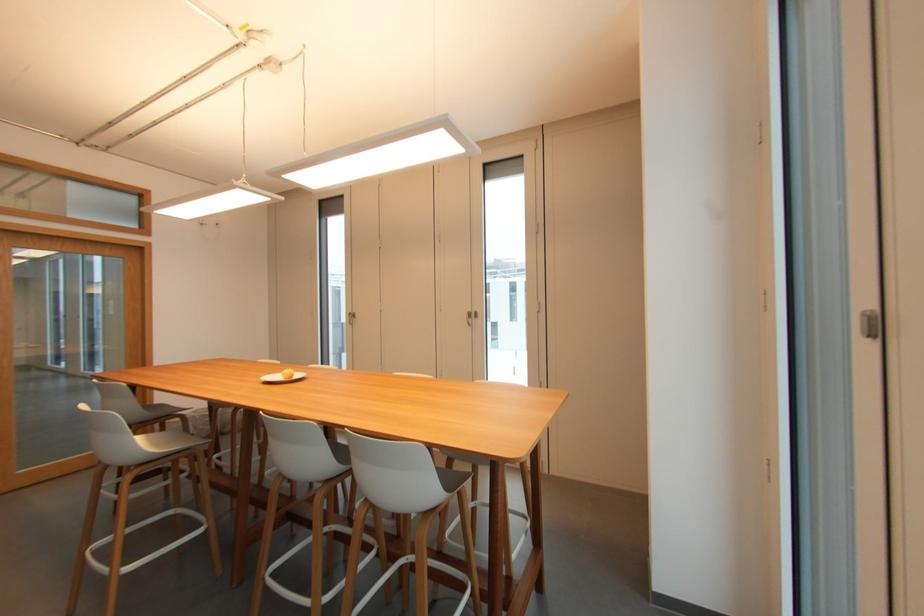
Which object does [283,377] point to?

This point indicates the small white plate.